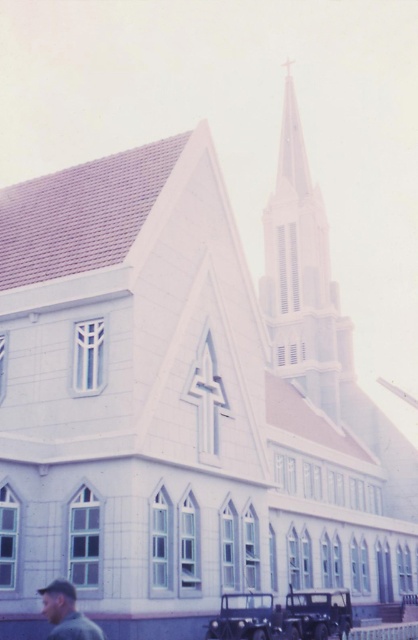
Between white stonework spire at upper center and matte gray shirt at lower left, which one has less height?

With less height is matte gray shirt at lower left.

Is point (288, 209) positioned after point (48, 637)?

Yes, it is.

Which is in front, point (292, 372) or point (56, 609)?

Point (56, 609) is in front.

Find the location of a particular element. white stonework spire at upper center is located at coordinates (303, 276).